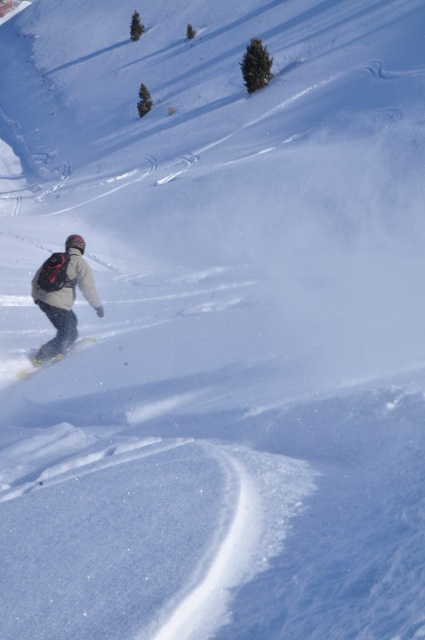
You are a photographer trying to capture the snowboarder and their board in a single frame. Given that your camera can only focus on objects wider than 10 inches, will both the matte black snowboarder at lower left and the white matte snowboard at lower left fit within the frame?

The matte black snowboarder at lower left is wider than the white matte snowboard at lower left. Since the snowboarder is wider than 10 inches, both objects will fit within the frame as long as their combined width doesn

You are a photographer trying to capture the snowboarder and their board in a single shot. Given that the matte black snowboarder at lower left and the white matte snowboard at lower left are both in your frame, which one will appear bigger in your photo?

The matte black snowboarder at lower left will appear bigger in the photo since it has a larger size compared to the white matte snowboard at lower left.

You are a drone operator trying to capture a photo of the snowboarder. The drone is currently at the point with coordinates point (62, 294). Can you confirm if this point is where the matte black snowboarder at lower left is located?

Yes, the point (62, 294) corresponds to the matte black snowboarder at lower left, so the drone is correctly positioned over them.